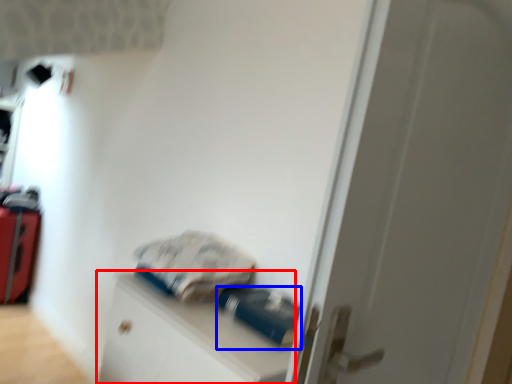
Question: Which point is further to the camera, file cabinet (highlighted by a red box) or equipment (highlighted by a blue box)?

Choices:
 (A) file cabinet
 (B) equipment

Answer: (B)